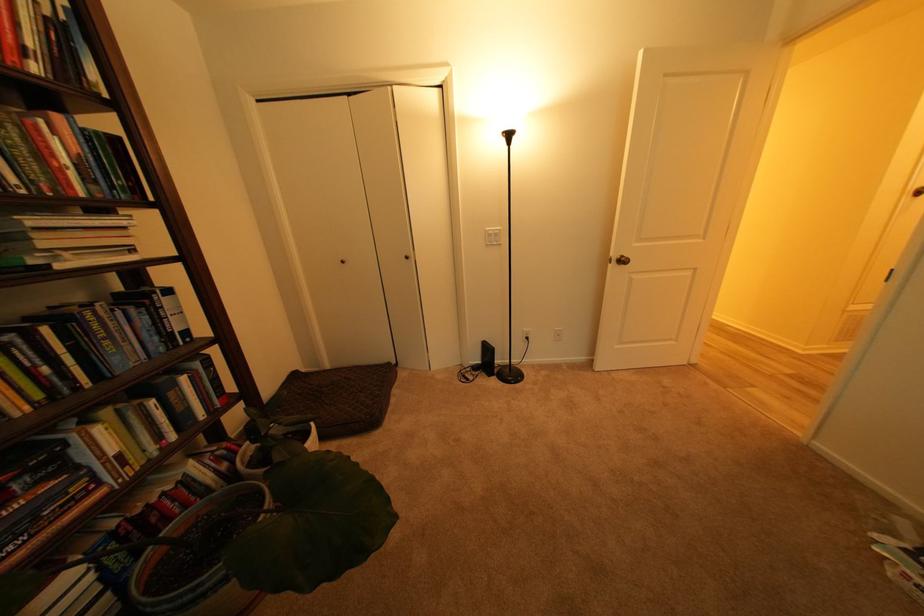
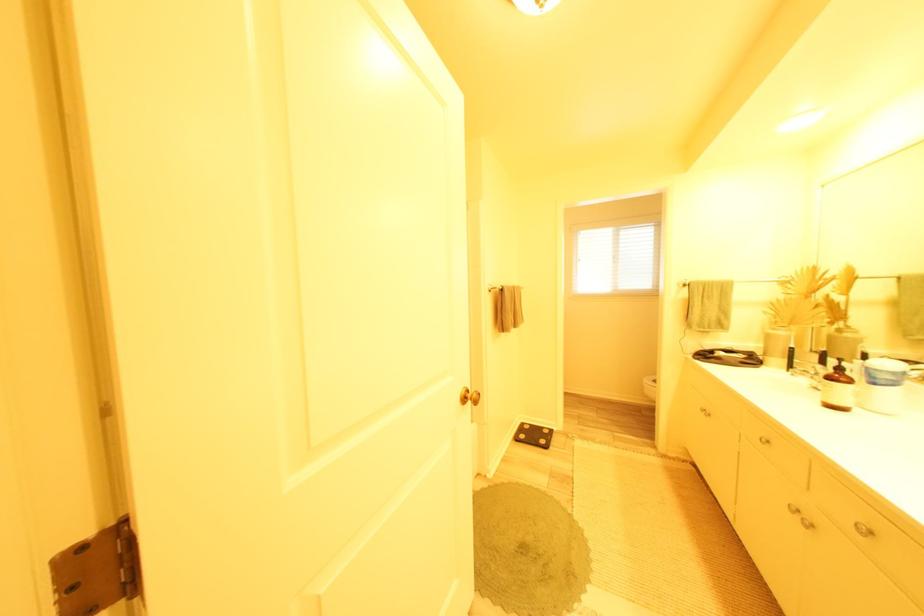
Question: I am providing you with two images of the same scene from different viewpoints. After the viewpoint changes to image2, which objects are now occluded?

Choices:
 (A) blue mattress edge
 (B) blue jar lid
 (C) cabinet knob
 (D) brass door handle

Answer: (D)